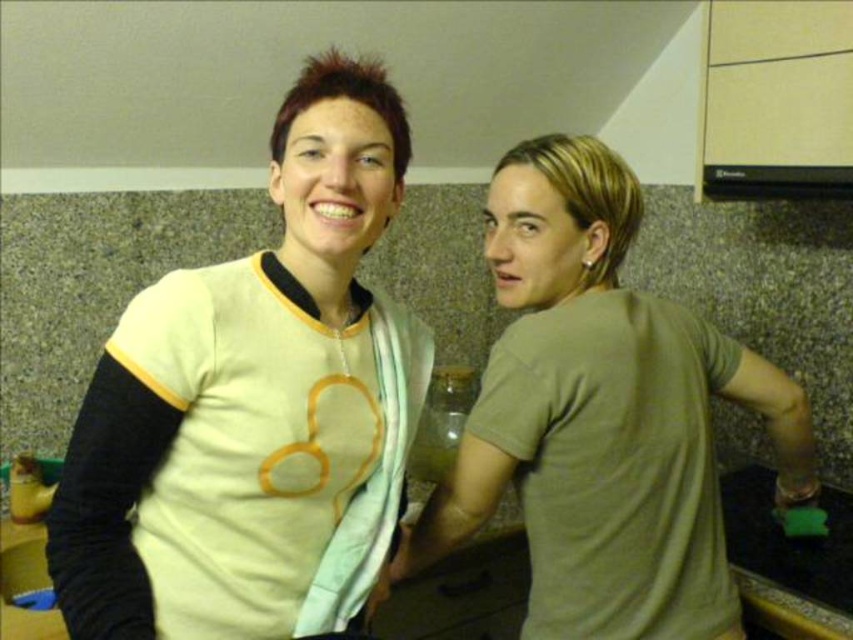
Who is higher up, matte olive green t-shirt at right or translucent glass bottle at center?

matte olive green t-shirt at right is above.

Who is lower down, matte olive green t-shirt at right or translucent glass bottle at center?

Positioned lower is translucent glass bottle at center.

You are a GUI agent. You are given a task and a screenshot of the screen. Output one action in this format:
    pyautogui.click(x=<x>, y=<y>)
    Task: Click on the matte olive green t-shirt at right
    
    Given the screenshot: What is the action you would take?
    pyautogui.click(x=602, y=417)

What are the coordinates of `matte olive green t-shirt at right` in the screenshot? It's located at (602, 417).